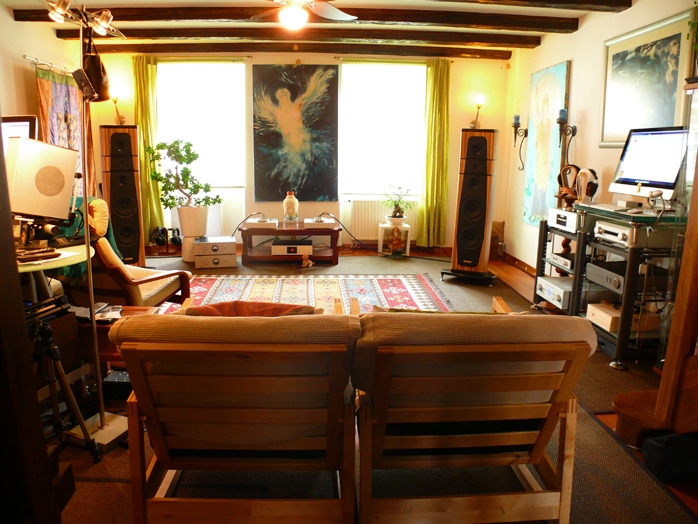
This screenshot has height=524, width=698. I want to click on hanging cloth, so click(38, 80).